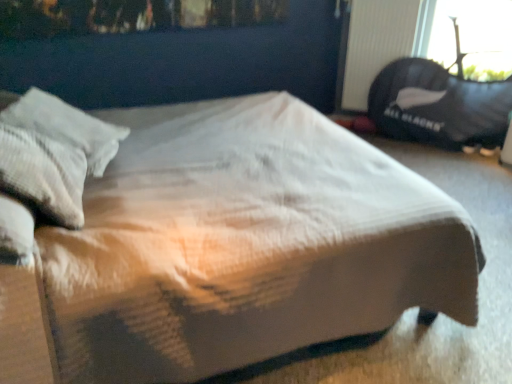
The height and width of the screenshot is (384, 512). What do you see at coordinates (438, 106) in the screenshot?
I see `black fabric bean bag at upper right` at bounding box center [438, 106].

Find the location of `black fabric bean bag at upper right`. black fabric bean bag at upper right is located at coordinates [x=438, y=106].

The width and height of the screenshot is (512, 384). Describe the element at coordinates (53, 153) in the screenshot. I see `gray textured pillow at left` at that location.

Locate an element on the screen. This screenshot has width=512, height=384. black fabric bean bag at upper right is located at coordinates (438, 106).

From the image's perspective, which is below, gray textured pillow at left or black fabric bean bag at upper right?

From the image's view, gray textured pillow at left is below.

Consider the image. Is gray textured pillow at left not near black fabric bean bag at upper right?

Indeed, gray textured pillow at left is not near black fabric bean bag at upper right.

The image size is (512, 384). I want to click on bean bag chair that is behind the gray textured pillow at left, so click(x=438, y=106).

Considering the sizes of gray textured pillow at left and black fabric bean bag at upper right in the image, is gray textured pillow at left wider or thinner than black fabric bean bag at upper right?

Answer: gray textured pillow at left is wider than black fabric bean bag at upper right.

Based on the photo, considering the relative sizes of white quilted fabric bed at center and gray textured pillow at left in the image provided, is white quilted fabric bed at center wider than gray textured pillow at left?

Correct, the width of white quilted fabric bed at center exceeds that of gray textured pillow at left.

Who is taller, white quilted fabric bed at center or gray textured pillow at left?

With more height is white quilted fabric bed at center.

From a real-world perspective, is white quilted fabric bed at center located higher than gray textured pillow at left?

Incorrect, from a real-world perspective, white quilted fabric bed at center is lower than gray textured pillow at left.

In the scene shown: Does white quilted fabric bed at center turn towards gray textured pillow at left?

No, white quilted fabric bed at center is not facing towards gray textured pillow at left.

Considering the relative sizes of black plastic radiator at upper right and black fabric bean bag at upper right in the image provided, is black plastic radiator at upper right shorter than black fabric bean bag at upper right?

Yes, black plastic radiator at upper right is shorter than black fabric bean bag at upper right.

Considering the positions of objects black plastic radiator at upper right and black fabric bean bag at upper right in the image provided, who is more to the left, black plastic radiator at upper right or black fabric bean bag at upper right?

Positioned to the left is black plastic radiator at upper right.

Which is more distant, [384,48] or [452,143]?

The point [384,48] is more distant.

Is white quilted fabric bed at center closer to the viewer compared to black plastic radiator at upper right?

Yes.

From the image's perspective, is white quilted fabric bed at center beneath black plastic radiator at upper right?

Yes, from the image's perspective, white quilted fabric bed at center is beneath black plastic radiator at upper right.

Who is bigger, white quilted fabric bed at center or black plastic radiator at upper right?

With larger size is white quilted fabric bed at center.

Locate an element on the screen. The image size is (512, 384). radiator to the right of white quilted fabric bed at center is located at coordinates (375, 44).

From the image's perspective, between black plastic radiator at upper right and white quilted fabric bed at center, who is located below?

white quilted fabric bed at center is shown below in the image.

Considering the sizes of objects black plastic radiator at upper right and white quilted fabric bed at center in the image provided, who is taller, black plastic radiator at upper right or white quilted fabric bed at center?

white quilted fabric bed at center.

Considering the relative sizes of black plastic radiator at upper right and white quilted fabric bed at center in the image provided, is black plastic radiator at upper right thinner than white quilted fabric bed at center?

Indeed, black plastic radiator at upper right has a lesser width compared to white quilted fabric bed at center.

Is black plastic radiator at upper right oriented towards white quilted fabric bed at center?

Yes, black plastic radiator at upper right is oriented towards white quilted fabric bed at center.

Consider the image. Is gray textured pillow at left closer to camera compared to white quilted fabric bed at center?

No, gray textured pillow at left is further to the viewer.

Considering the relative sizes of gray textured pillow at left and white quilted fabric bed at center in the image provided, is gray textured pillow at left smaller than white quilted fabric bed at center?

Yes.

Consider the image. Is gray textured pillow at left taller than white quilted fabric bed at center?

No, gray textured pillow at left is not taller than white quilted fabric bed at center.

Looking at this image, is gray textured pillow at left far from white quilted fabric bed at center?

gray textured pillow at left is near white quilted fabric bed at center, not far away.

In the image, there is a gray textured pillow at left. At what (x,y) coordinates should I click in order to perform the action: click on bean bag chair below it (from a real-world perspective). Please return your answer as a coordinate pair (x, y). The height and width of the screenshot is (384, 512). Looking at the image, I should click on (438, 106).

Considering the positions of point (508, 86) and point (85, 119), is point (508, 86) closer or farther from the camera than point (85, 119)?

Point (508, 86) is positioned farther from the camera compared to point (85, 119).

Is black fabric bean bag at upper right looking in the opposite direction of gray textured pillow at left?

No.

From the image's perspective, is black fabric bean bag at upper right located above or below gray textured pillow at left?

black fabric bean bag at upper right is situated higher than gray textured pillow at left in the image.

The height and width of the screenshot is (384, 512). I want to click on pillow that appears below the black fabric bean bag at upper right (from the image's perspective), so click(53, 153).

This screenshot has width=512, height=384. Find the location of `pillow that appears above the white quilted fabric bed at center (from a real-world perspective)`. pillow that appears above the white quilted fabric bed at center (from a real-world perspective) is located at coordinates (53, 153).

When comparing their distances from black plastic radiator at upper right, does black fabric bean bag at upper right or white quilted fabric bed at center seem closer?

black fabric bean bag at upper right is positioned closer to the anchor black plastic radiator at upper right.

Based on their spatial positions, is white quilted fabric bed at center or black plastic radiator at upper right closer to black fabric bean bag at upper right?

black plastic radiator at upper right.

When comparing their distances from white quilted fabric bed at center, does black plastic radiator at upper right or black fabric bean bag at upper right seem further?

Among the two, black plastic radiator at upper right is located further to white quilted fabric bed at center.

Looking at the image, which one is located closer to gray textured pillow at left, white quilted fabric bed at center or black fabric bean bag at upper right?

white quilted fabric bed at center lies closer to gray textured pillow at left than the other object.

Considering their positions, is white quilted fabric bed at center positioned further to black plastic radiator at upper right than black fabric bean bag at upper right?

The object further to black plastic radiator at upper right is white quilted fabric bed at center.

When comparing their distances from black fabric bean bag at upper right, does black plastic radiator at upper right or gray textured pillow at left seem further?

gray textured pillow at left lies further to black fabric bean bag at upper right than the other object.

From the picture: From the image, which object appears to be nearer to black fabric bean bag at upper right, gray textured pillow at left or white quilted fabric bed at center?

white quilted fabric bed at center is closer to black fabric bean bag at upper right.

Which object lies nearer to the anchor point black fabric bean bag at upper right, gray textured pillow at left or black plastic radiator at upper right?

black plastic radiator at upper right.

Locate an element on the screen. The width and height of the screenshot is (512, 384). pillow between white quilted fabric bed at center and black fabric bean bag at upper right from front to back is located at coordinates (53, 153).

In order to click on bean bag chair between white quilted fabric bed at center and black plastic radiator at upper right in the front-back direction in this screenshot , I will do `click(438, 106)`.

You are a GUI agent. You are given a task and a screenshot of the screen. Output one action in this format:
    pyautogui.click(x=<x>, y=<y>)
    Task: Click on the pillow between white quilted fabric bed at center and black plastic radiator at upper right along the z-axis
    The width and height of the screenshot is (512, 384).
    Given the screenshot: What is the action you would take?
    click(53, 153)

Locate an element on the screen. The width and height of the screenshot is (512, 384). radiator situated between gray textured pillow at left and black fabric bean bag at upper right from left to right is located at coordinates (375, 44).